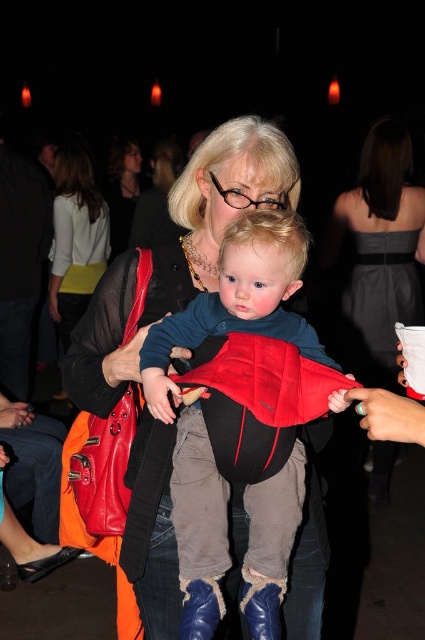
You are attending a party and need to choose between the gray satin dress at upper right and the matte black jacket at upper center for your outfit. Which item is bigger in size?

The gray satin dress at upper right is larger in size compared to the matte black jacket at upper center.

Consider the image. You are planning to place a 10 feet long decorative banner between the gray satin dress at upper right and the matte black jacket at upper center. Will the banner fit without overlapping either object?

The distance between the gray satin dress at upper right and the matte black jacket at upper center is 9.55 feet. Since the banner is 10 feet long, it will extend beyond the space between them, causing overlap with both objects.

Based on the photo, you are taking a photo of the woman and child. You want to focus on the point at point (82,257) and point (122,220). Which point is closer to the camera?

Point (82,257) is closer to the camera than point (122,220).